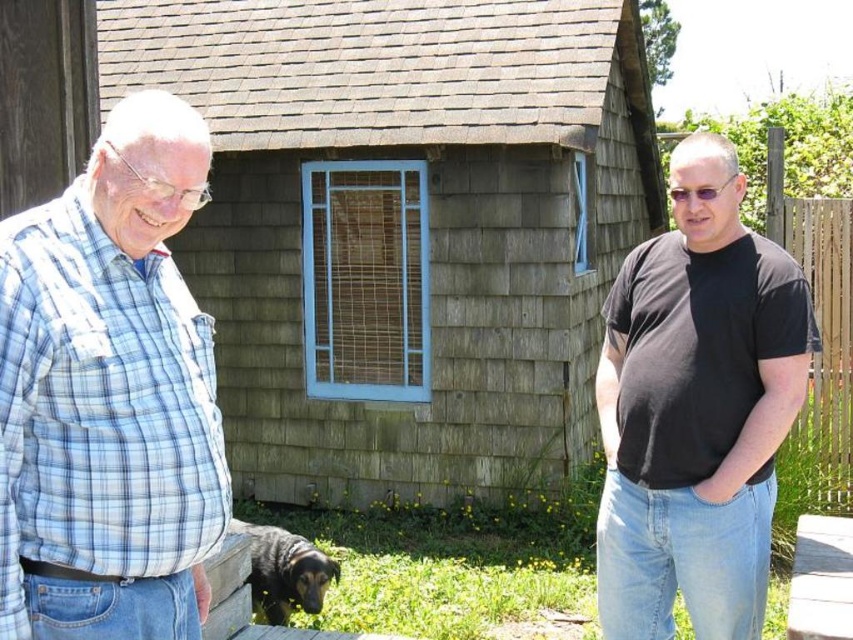
Question: Is wooden picnic table at lower right above shiny black dog at lower left?

Choices:
 (A) no
 (B) yes

Answer: (B)

Question: Which object is positioned closest to the wooden cabin at center?

Choices:
 (A) wooden picnic table at lower right
 (B) black matte t-shirt at right
 (C) shiny black dog at lower left
 (D) blue plaid shirt at left

Answer: (C)

Question: Which object is the farthest from the wooden picnic table at lower right?

Choices:
 (A) shiny black dog at lower left
 (B) wooden cabin at center
 (C) blue plaid shirt at left

Answer: (B)

Question: Can you confirm if black matte t-shirt at right is thinner than shiny black dog at lower left?

Choices:
 (A) yes
 (B) no

Answer: (B)

Question: Is blue plaid shirt at left thinner than wooden picnic table at lower right?

Choices:
 (A) no
 (B) yes

Answer: (B)

Question: Which point appears farthest from the camera in this image?

Choices:
 (A) [843, 552]
 (B) [302, 564]
 (C) [647, 113]
 (D) [146, 467]

Answer: (C)